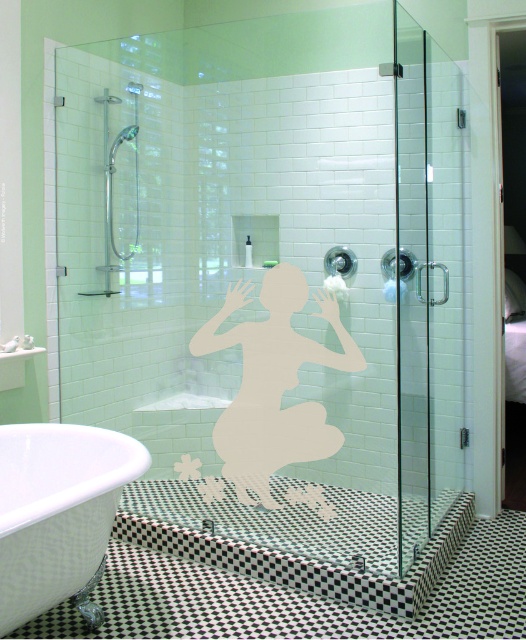
Question: Can you confirm if white glossy bathtub at lower left is positioned to the right of white matte silhouette at center?

Choices:
 (A) no
 (B) yes

Answer: (A)

Question: Which point is farther to the camera?

Choices:
 (A) (31, 566)
 (B) (274, 440)

Answer: (B)

Question: Which object is closer to the camera taking this photo?

Choices:
 (A) white matte silhouette at center
 (B) white glossy bathtub at lower left

Answer: (B)

Question: Can you confirm if white glossy bathtub at lower left is bigger than white matte silhouette at center?

Choices:
 (A) no
 (B) yes

Answer: (A)

Question: Does white glossy bathtub at lower left have a lesser width compared to white matte silhouette at center?

Choices:
 (A) yes
 (B) no

Answer: (A)